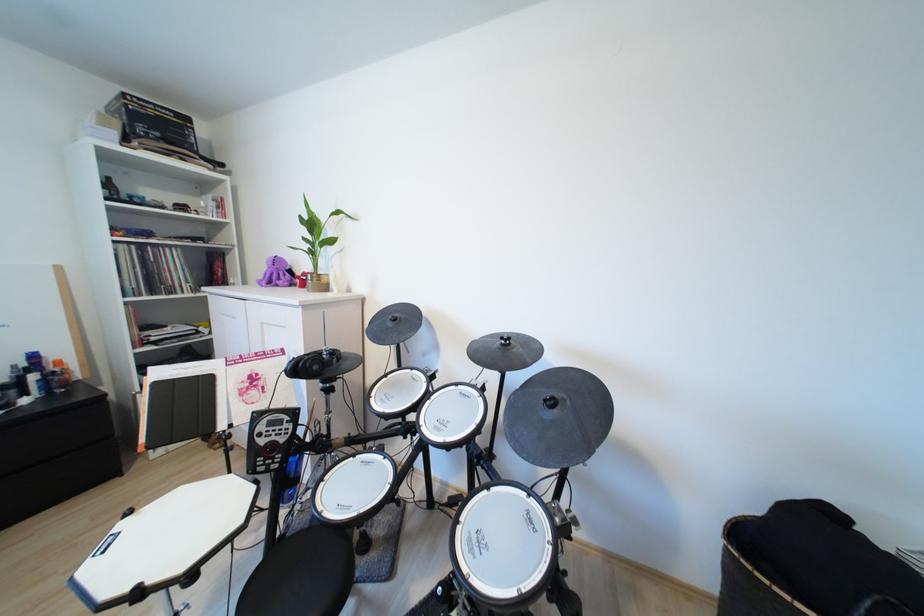
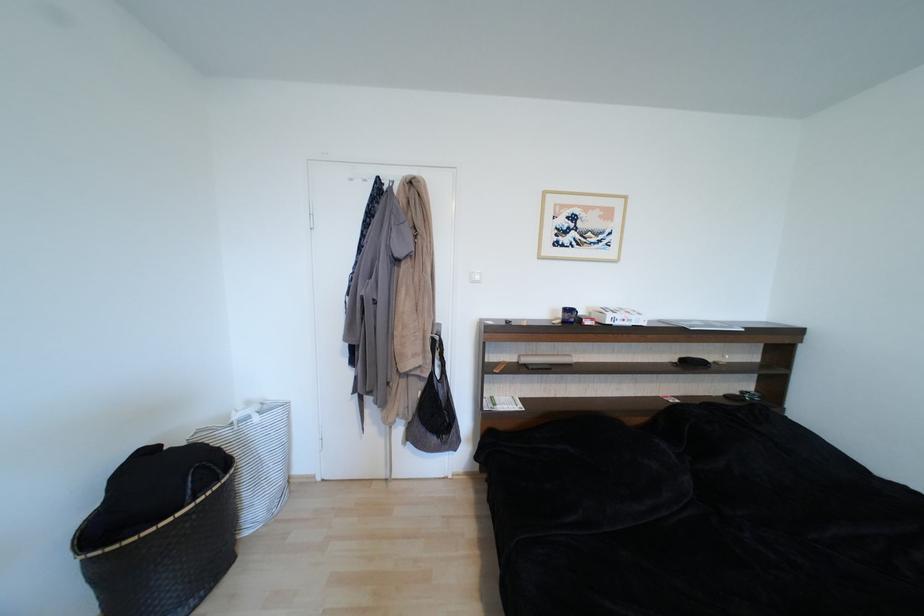
Question: The camera is either moving clockwise (left) or counter-clockwise (right) around the object. The first image is from the beginning of the video and the second image is from the end. Is the camera moving left or right when shooting the video?

Choices:
 (A) Left
 (B) Right

Answer: (A)